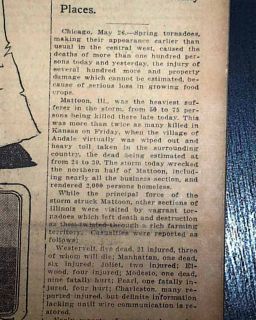
At what (x,y) coordinates should I click in order to perform the action: click on glare from light source. Please return your answer as a coordinate pair (x, y). The image size is (256, 320). Looking at the image, I should click on (232, 235).